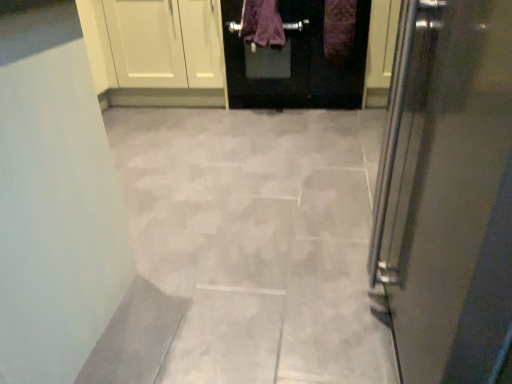
Question: Considering the positions of purple fabric at center, which appears as the second blanket when viewed from the right, and gray stone tile at center in the image, is purple fabric at center, which appears as the second blanket when viewed from the right, taller or shorter than gray stone tile at center?

Choices:
 (A) short
 (B) tall

Answer: (B)

Question: Based on their positions, is purple fabric at center, which is the first blanket in left-to-right order, located to the left or right of gray stone tile at center?

Choices:
 (A) left
 (B) right

Answer: (B)

Question: Estimate the real-world distances between objects in this image. Which object is closer to the purple fuzzy blanket at upper center, the second blanket from the left?

Choices:
 (A) purple fabric at center, which appears as the second blanket when viewed from the right
 (B) matte black door at upper center
 (C) gray stone tile at center

Answer: (B)

Question: Which object is positioned closest to the matte black door at upper center?

Choices:
 (A) purple fuzzy blanket at upper center, the second blanket from the left
 (B) gray stone tile at center
 (C) purple fabric at center, which is the first blanket in left-to-right order

Answer: (C)